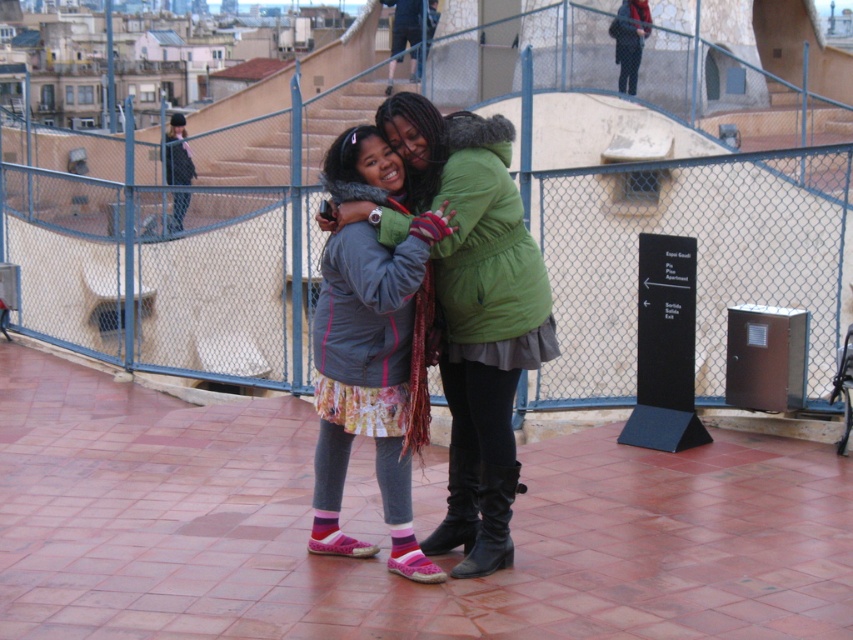
You are a delivery drone trying to land on the rooftop terrace. You notice the blue wire mesh at center and the black leather boot at center. Which object has a wider structure to safely land between them?

The blue wire mesh at center has a wider structure than the black leather boot at center, so you should aim to land near the blue wire mesh at center for safety.

From the picture: You are standing on the rooftop terrace and want to place a small potted plant between the blue wire mesh at center and the black leather boot at lower center. Which object should the plant be closer to based on their positions?

The blue wire mesh at center is located above the black leather boot at lower center, so the plant should be placed closer to the black leather boot at lower center to be between them.